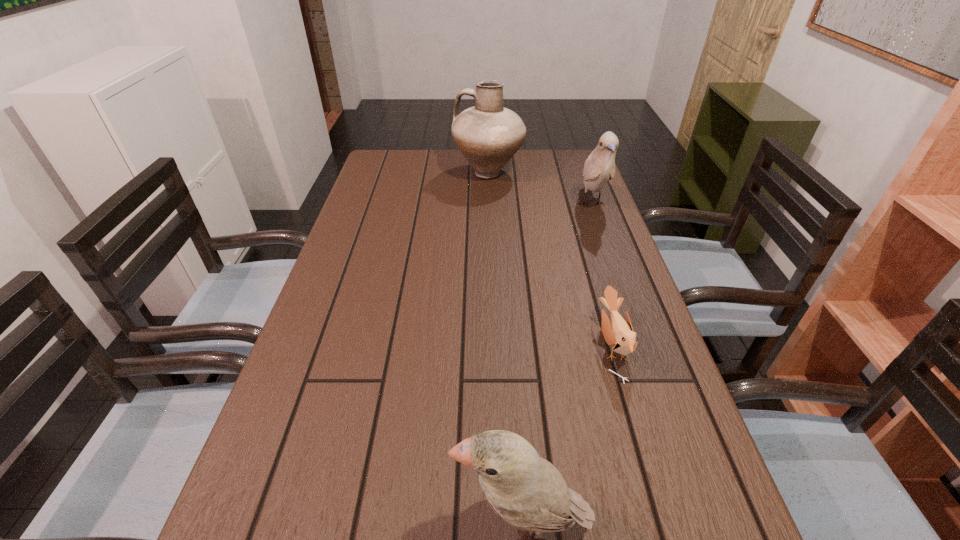
The height and width of the screenshot is (540, 960). Identify the location of pitcher. (488, 135).

You are a GUI agent. You are given a task and a screenshot of the screen. Output one action in this format:
    pyautogui.click(x=<x>, y=<y>)
    Task: Click on the farthest bird
    This screenshot has width=960, height=540.
    Given the screenshot: What is the action you would take?
    pyautogui.click(x=600, y=166)

At what (x,y) coordinates should I click in order to perform the action: click on the third farthest object. Please return your answer as a coordinate pair (x, y). Image resolution: width=960 pixels, height=540 pixels. Looking at the image, I should click on (620, 335).

Identify the location of the shortest bird. (620, 335).

At what (x,y) coordinates should I click in order to perform the action: click on free location located on the handle side of the pitcher. Please return your answer as a coordinate pair (x, y). The width and height of the screenshot is (960, 540). Looking at the image, I should click on (393, 173).

The image size is (960, 540). Identify the location of blank area located on the handle side of the pitcher. (432, 173).

Locate an element on the screen. Image resolution: width=960 pixels, height=540 pixels. vacant area located 0.070m on the handle side of the pitcher is located at coordinates (432, 173).

Where is `free space located 0.190m at the beak of the farthest bird`? This screenshot has width=960, height=540. free space located 0.190m at the beak of the farthest bird is located at coordinates (615, 268).

Locate an element on the screen. vacant space located 0.280m at the beak of the shortest object is located at coordinates (461, 345).

This screenshot has width=960, height=540. I want to click on free space located at the beak of the shortest object, so click(x=540, y=345).